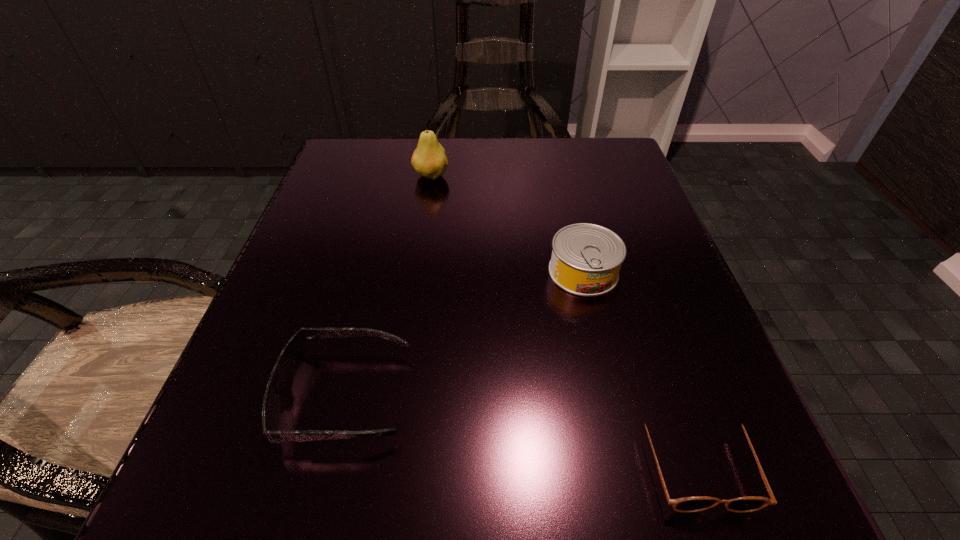
Locate an element on the screen. object present at the left edge is located at coordinates (292, 355).

The width and height of the screenshot is (960, 540). I want to click on can at the right edge, so click(x=586, y=258).

At what (x,y) coordinates should I click in order to perform the action: click on sunglasses that is at the right edge. Please return your answer as a coordinate pair (x, y). Looking at the image, I should click on (746, 504).

I want to click on object at the near left corner, so click(x=292, y=355).

Locate an element on the screen. object that is positioned at the near right corner is located at coordinates (746, 504).

Image resolution: width=960 pixels, height=540 pixels. Identify the location of free space at the far edge. (480, 163).

You are a GUI agent. You are given a task and a screenshot of the screen. Output one action in this format:
    pyautogui.click(x=<x>, y=<y>)
    Task: Click on the free space at the left edge of the desktop
    The width and height of the screenshot is (960, 540).
    Given the screenshot: What is the action you would take?
    pyautogui.click(x=340, y=209)

In the image, there is a desktop. Identify the location of free space at the right edge. The width and height of the screenshot is (960, 540). (618, 423).

The width and height of the screenshot is (960, 540). In the image, there is a desktop. What are the coordinates of `free region at the far left corner` in the screenshot? It's located at (392, 165).

Locate an element on the screen. Image resolution: width=960 pixels, height=540 pixels. free region at the far right corner of the desktop is located at coordinates (570, 195).